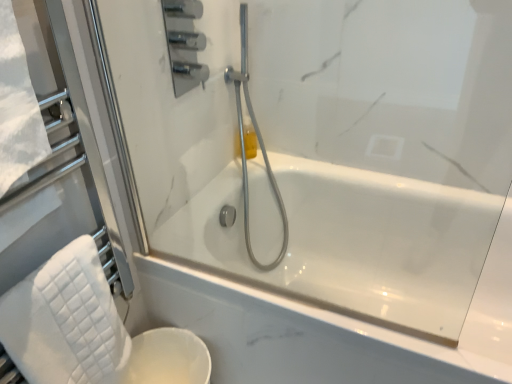
Question: Is white glossy toilet bowl at lower left aimed at translucent yellow bottle at upper center?

Choices:
 (A) yes
 (B) no

Answer: (B)

Question: Can you confirm if white glossy toilet bowl at lower left is positioned to the left of translucent yellow bottle at upper center?

Choices:
 (A) yes
 (B) no

Answer: (A)

Question: Considering the relative sizes of white glossy toilet bowl at lower left and translucent yellow bottle at upper center in the image provided, is white glossy toilet bowl at lower left bigger than translucent yellow bottle at upper center?

Choices:
 (A) no
 (B) yes

Answer: (B)

Question: Is translucent yellow bottle at upper center at the back of white glossy toilet bowl at lower left?

Choices:
 (A) no
 (B) yes

Answer: (A)

Question: From the image's perspective, is white glossy toilet bowl at lower left on top of translucent yellow bottle at upper center?

Choices:
 (A) yes
 (B) no

Answer: (B)

Question: In the image, is white glossy toilet bowl at lower left positioned in front of or behind white quilted towel at lower left?

Choices:
 (A) behind
 (B) front

Answer: (A)

Question: Is white glossy toilet bowl at lower left inside or outside of white quilted towel at lower left?

Choices:
 (A) outside
 (B) inside

Answer: (A)

Question: Visually, is white glossy toilet bowl at lower left positioned to the left or to the right of white quilted towel at lower left?

Choices:
 (A) left
 (B) right

Answer: (B)

Question: Considering the positions of white glossy toilet bowl at lower left and white quilted towel at lower left in the image, is white glossy toilet bowl at lower left wider or thinner than white quilted towel at lower left?

Choices:
 (A) wide
 (B) thin

Answer: (A)

Question: Is point (251, 139) positioned closer to the camera than point (159, 372)?

Choices:
 (A) farther
 (B) closer

Answer: (A)

Question: From their relative heights in the image, would you say translucent yellow bottle at upper center is taller or shorter than white glossy toilet bowl at lower left?

Choices:
 (A) short
 (B) tall

Answer: (A)

Question: From a real-world perspective, is translucent yellow bottle at upper center above or below white glossy toilet bowl at lower left?

Choices:
 (A) below
 (B) above

Answer: (B)

Question: Considering their positions, is translucent yellow bottle at upper center located in front of or behind white glossy toilet bowl at lower left?

Choices:
 (A) front
 (B) behind

Answer: (B)

Question: From the image's perspective, is satin chrome shower head at center located above or below white quilted towel at lower left?

Choices:
 (A) below
 (B) above

Answer: (B)

Question: Looking at their shapes, would you say satin chrome shower head at center is wider or thinner than white quilted towel at lower left?

Choices:
 (A) thin
 (B) wide

Answer: (B)